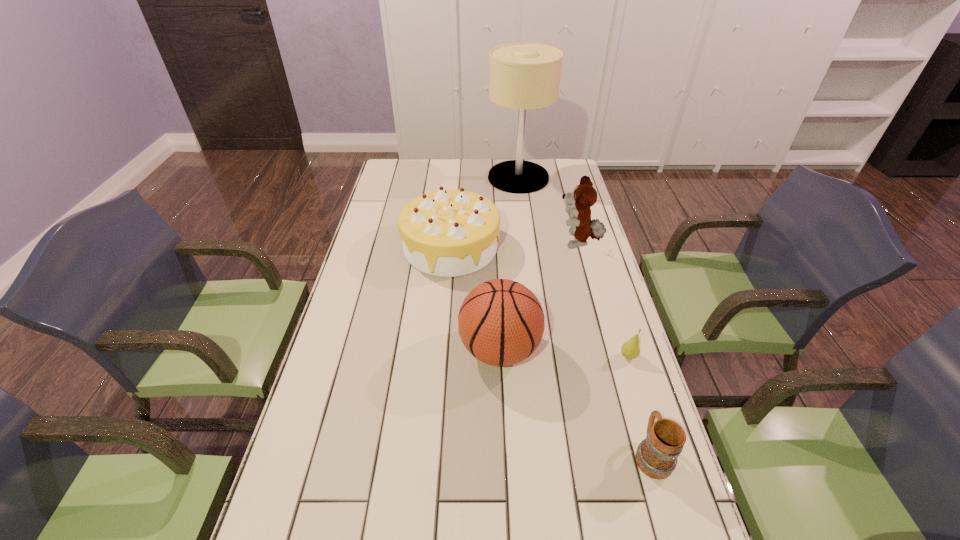
You are a GUI agent. You are given a task and a screenshot of the screen. Output one action in this format:
    pyautogui.click(x=<x>, y=<y>)
    Task: Click on the vacant region that satisfies the following two spatial constraints: 1. on the face of the puppy; 2. on the side of the nearest object with the handle
    This screenshot has height=540, width=960.
    Given the screenshot: What is the action you would take?
    pyautogui.click(x=636, y=455)

At what (x,y) coordinates should I click in order to perform the action: click on blank area in the image that satisfies the following two spatial constraints: 1. on the side where the inflation valve is located; 2. on the side of the nearest object with the handle. Please return your answer as a coordinate pair (x, y). The image size is (960, 540). Looking at the image, I should click on (504, 455).

What are the coordinates of `vacant region that satisfies the following two spatial constraints: 1. on the side of the mug with the handle; 2. on the face of the puppy` in the screenshot? It's located at (588, 244).